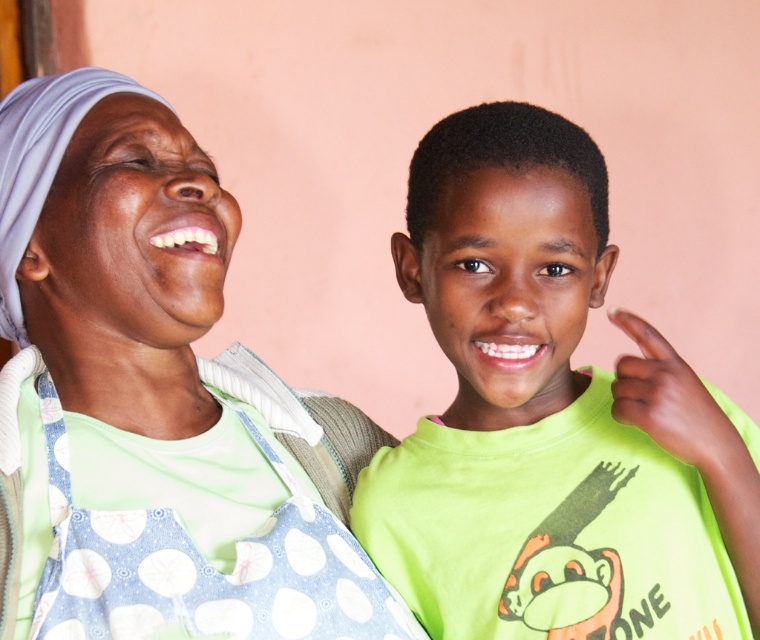
Question: Can you confirm if green matte shirt at center is thinner than blue polka dot fabric apron at center?

Choices:
 (A) yes
 (B) no

Answer: (B)

Question: Which object is the closest to the green matte shirt at center?

Choices:
 (A) polka dot apron at left
 (B) blue polka dot fabric apron at center

Answer: (B)

Question: Which point appears closest to the camera in this image?

Choices:
 (A) (108, 321)
 (B) (176, 516)
 (C) (470, 307)

Answer: (C)

Question: Can you confirm if polka dot apron at left is positioned above green matte shirt at center?

Choices:
 (A) yes
 (B) no

Answer: (B)

Question: Which is farther from the blue polka dot fabric apron at center?

Choices:
 (A) polka dot apron at left
 (B) green matte shirt at center

Answer: (B)

Question: Can you confirm if polka dot apron at left is bigger than blue polka dot fabric apron at center?

Choices:
 (A) yes
 (B) no

Answer: (A)